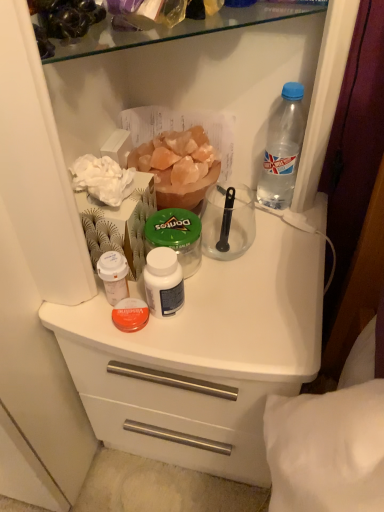
Where is `vacant area on top of white matte plastic counter at center (from a real-world perspective)`? The image size is (384, 512). vacant area on top of white matte plastic counter at center (from a real-world perspective) is located at coordinates (238, 265).